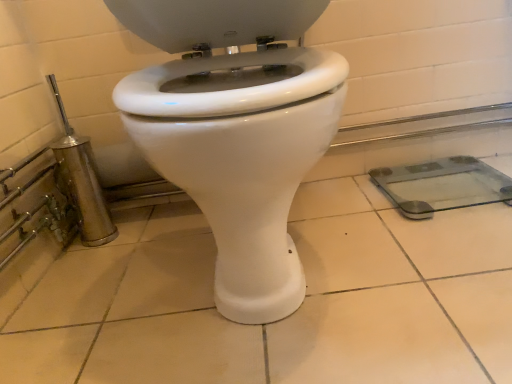
Where is `vacant area that is in front of transparent glass scale at right`? This screenshot has width=512, height=384. vacant area that is in front of transparent glass scale at right is located at coordinates (449, 249).